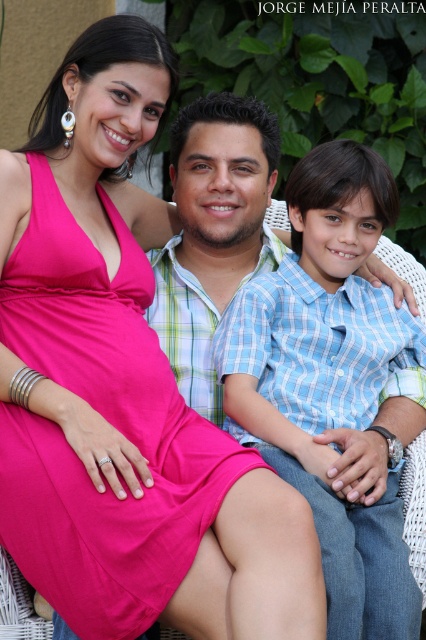
Can you confirm if matte pink dress at center is positioned below blue plaid shirt at center?

Incorrect, matte pink dress at center is not positioned below blue plaid shirt at center.

Between matte pink dress at center and blue plaid shirt at center, which one has more height?

Standing taller between the two is blue plaid shirt at center.

What do you see at coordinates (106, 419) in the screenshot? The width and height of the screenshot is (426, 640). I see `matte pink dress at center` at bounding box center [106, 419].

Locate an element on the screen. matte pink dress at center is located at coordinates (106, 419).